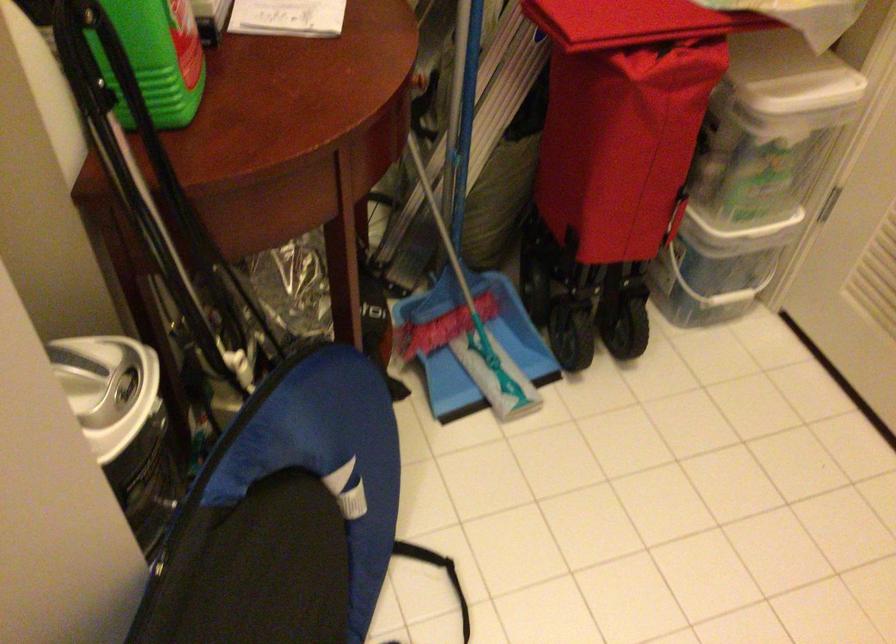
The image size is (896, 644). What are the coordinates of `green plastic bottle` in the screenshot? It's located at (156, 59).